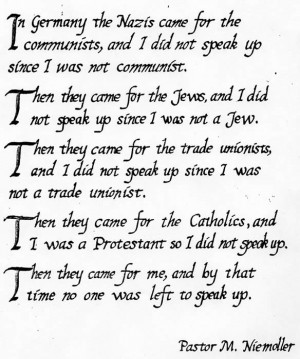
Find the location of `corner`. corner is located at coordinates (298, 356), (2, 354), (1, 0), (297, 1).